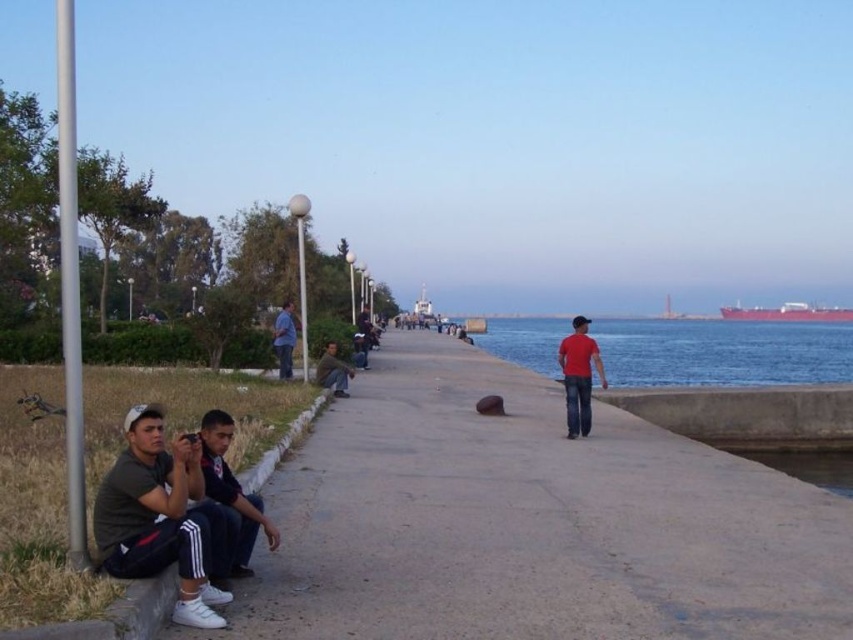
You are a photographer standing on the walkway and want to take a photo of both the dark green jersey at lower left and the red matte cargo ship at far right. Can you position yourself so that both are visible in the same frame without one blocking the other?

The dark green jersey at lower left is in front of the red matte cargo ship at far right, so if you position yourself behind the dark green jersey at lower left, you can capture both in the same frame with the jersey in the foreground and the ship in the background.

You are a photographer trying to capture a photo of both the dark blue jeans at lower left and the matte red shirt at center. Which object should you focus on first if you want to ensure both are in sharp focus?

You should focus on the matte red shirt at center first because it is taller than the dark blue jeans at lower left, allowing the depth of field to cover both subjects effectively.

You are standing on the walkway and notice two objects in the scene. One is the concrete at left and the other is the dark blue jeans at lower left. Which object is closer to the water?

The dark blue jeans at lower left are closer to the water because the concrete at left is to the right of dark blue jeans at lower left, meaning the jeans are positioned further left near the water edge.